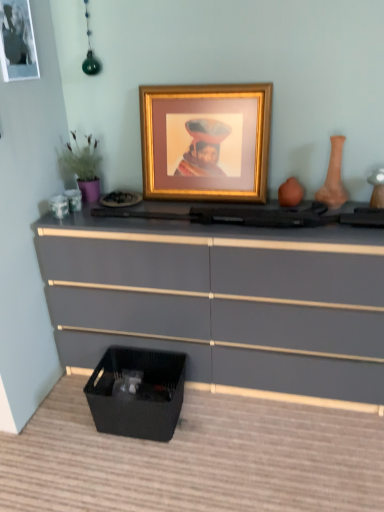
Question: Is matte gray chest of drawers at lower center shorter than green matte plant at left?

Choices:
 (A) no
 (B) yes

Answer: (A)

Question: Is matte gray chest of drawers at lower center positioned with its back to green matte plant at left?

Choices:
 (A) no
 (B) yes

Answer: (A)

Question: From the image's perspective, does matte gray chest of drawers at lower center appear lower than green matte plant at left?

Choices:
 (A) no
 (B) yes

Answer: (B)

Question: Does matte gray chest of drawers at lower center have a smaller size compared to green matte plant at left?

Choices:
 (A) yes
 (B) no

Answer: (B)

Question: From the image's perspective, is matte gray chest of drawers at lower center above green matte plant at left?

Choices:
 (A) no
 (B) yes

Answer: (A)

Question: From the image's perspective, relative to metallic gold picture frame at upper left, which ranks as the 2th picture frame in right-to-left order, is green matte plant at left above or below?

Choices:
 (A) above
 (B) below

Answer: (B)

Question: Is green matte plant at left spatially inside metallic gold picture frame at upper left, which ranks as the 2th picture frame in right-to-left order, or outside of it?

Choices:
 (A) inside
 (B) outside

Answer: (B)

Question: Looking at the image, does green matte plant at left seem bigger or smaller compared to metallic gold picture frame at upper left, the 1th picture frame positioned from the left?

Choices:
 (A) small
 (B) big

Answer: (B)

Question: Visually, is green matte plant at left positioned to the left or to the right of metallic gold picture frame at upper left, which ranks as the 2th picture frame in right-to-left order?

Choices:
 (A) left
 (B) right

Answer: (B)

Question: Looking at their shapes, would you say matte gray chest of drawers at lower center is wider or thinner than green matte plant at left?

Choices:
 (A) wide
 (B) thin

Answer: (A)

Question: Is matte gray chest of drawers at lower center bigger or smaller than green matte plant at left?

Choices:
 (A) big
 (B) small

Answer: (A)

Question: Does point pyautogui.click(x=324, y=234) appear closer or farther from the camera than point pyautogui.click(x=86, y=193)?

Choices:
 (A) closer
 (B) farther

Answer: (A)

Question: Would you say matte gray chest of drawers at lower center is to the left or to the right of green matte plant at left in the picture?

Choices:
 (A) left
 (B) right

Answer: (B)

Question: From a real-world perspective, is matte gray chest of drawers at lower center above or below terracotta clay vase at right?

Choices:
 (A) above
 (B) below

Answer: (B)

Question: Is matte gray chest of drawers at lower center in front of or behind terracotta clay vase at right in the image?

Choices:
 (A) behind
 (B) front

Answer: (B)